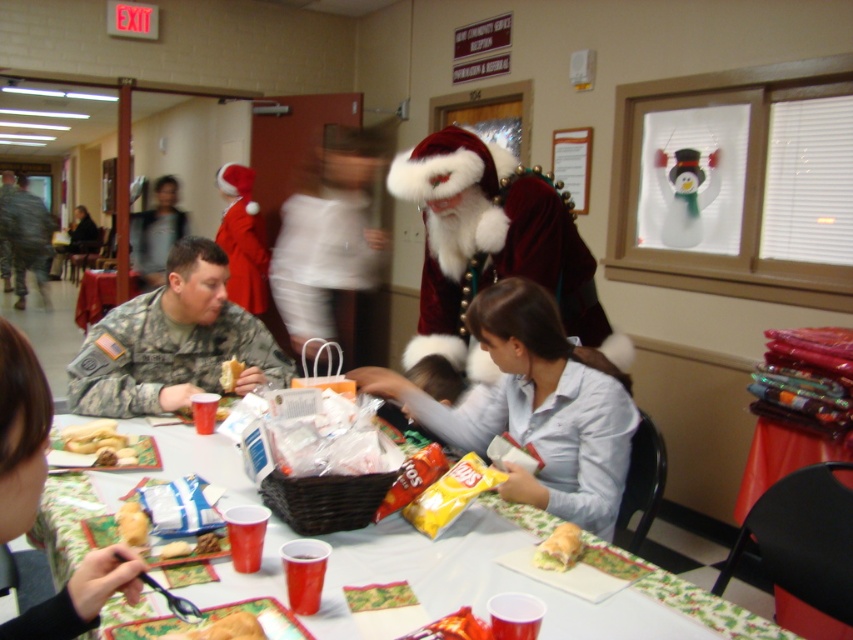
Question: Which point is closer to the camera?

Choices:
 (A) (537, 561)
 (B) (485, 218)

Answer: (A)

Question: Which point is closer to the camera?

Choices:
 (A) (439, 561)
 (B) (163, 552)
 (C) (399, 374)
 (D) (434, 332)

Answer: (B)

Question: Can you confirm if velvet santa at center is positioned above golden crumbly cookie at lower left?

Choices:
 (A) yes
 (B) no

Answer: (A)

Question: Among these points, which one is nearest to the camera?

Choices:
 (A) (230, 360)
 (B) (115, 445)
 (C) (134, 301)

Answer: (B)

Question: Where is camouflage uniform at center located in relation to matte plastic bag at center in the image?

Choices:
 (A) left
 (B) right

Answer: (A)

Question: Does light blue cotton shirt at center lie behind golden crumbly cookie at lower left?

Choices:
 (A) yes
 (B) no

Answer: (A)